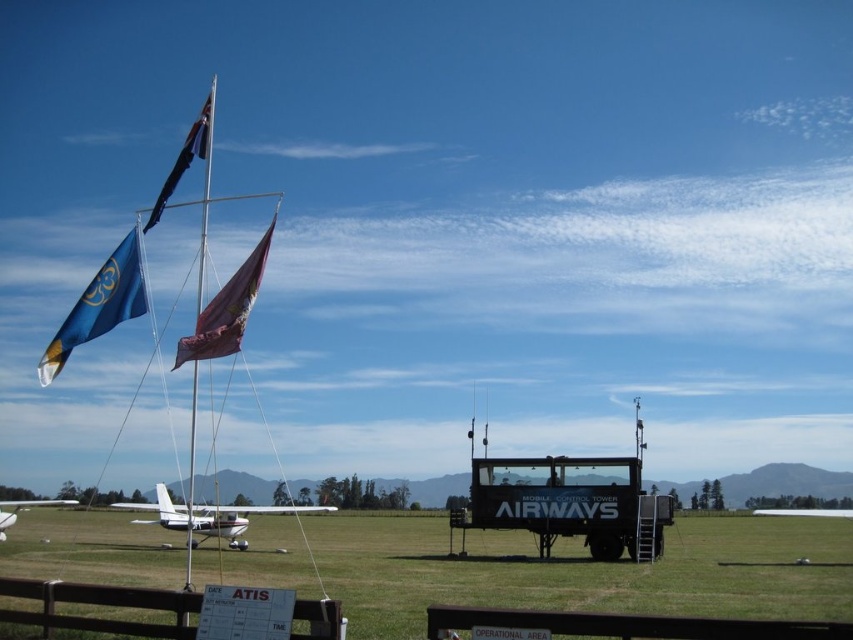
Question: From the image, what is the correct spatial relationship of white matte airplane at center in relation to blue fabric flag at upper center?

Choices:
 (A) above
 (B) below

Answer: (B)

Question: Considering the relative positions of white matte airplane at center and metallic flag pole at center in the image provided, where is white matte airplane at center located with respect to metallic flag pole at center?

Choices:
 (A) below
 (B) above

Answer: (A)

Question: Can you confirm if green grassy field at center is positioned above white matte airplane at lower left?

Choices:
 (A) no
 (B) yes

Answer: (B)

Question: Which of the following is the farthest from the observer?

Choices:
 (A) (213, 506)
 (B) (200, 138)
 (C) (61, 348)

Answer: (A)

Question: Which point is closer to the camera?

Choices:
 (A) blue fabric flag at upper center
 (B) white matte airplane at center

Answer: (A)

Question: Which point is closer to the camera?

Choices:
 (A) [x=189, y=138]
 (B) [x=328, y=509]

Answer: (A)